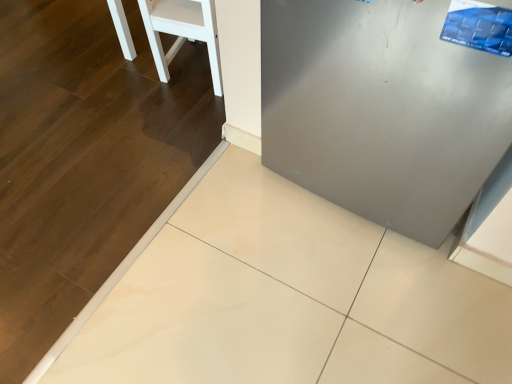
Locate an element on the screen. This screenshot has height=384, width=512. free spot in front of white matte chair at upper left is located at coordinates (178, 115).